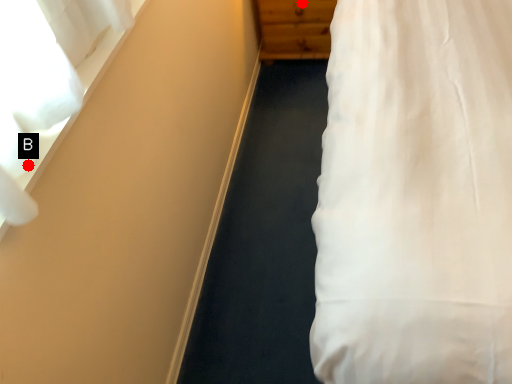
Question: Two points are circled on the image, labeled by A and B beside each circle. Which point is closer to the camera?

Choices:
 (A) A is closer
 (B) B is closer

Answer: (B)